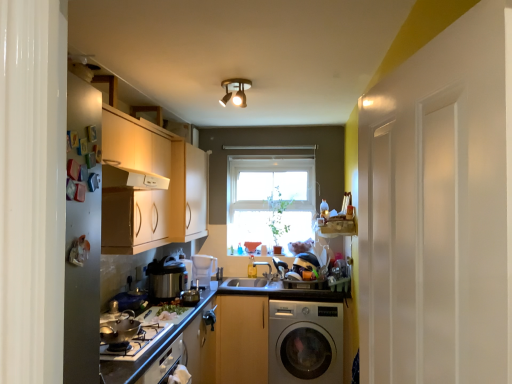
Question: From the image's perspective, is metallic pressure cooker at center over wooden cabinet at center, marked as the first cabinetry in a bottom-to-top arrangement?

Choices:
 (A) no
 (B) yes

Answer: (B)

Question: Considering the relative sizes of metallic pressure cooker at center and wooden cabinet at center, which is the 2th cabinetry from left to right, in the image provided, is metallic pressure cooker at center taller than wooden cabinet at center, which is the 2th cabinetry from left to right,?

Choices:
 (A) yes
 (B) no

Answer: (B)

Question: Is metallic pressure cooker at center thinner than wooden cabinet at center, which is the 2th cabinetry from left to right?

Choices:
 (A) no
 (B) yes

Answer: (B)

Question: From the image's perspective, is metallic pressure cooker at center below wooden cabinet at center, acting as the second cabinetry starting from the top?

Choices:
 (A) yes
 (B) no

Answer: (B)

Question: Is wooden cabinet at center, which is the 2th cabinetry from left to right, inside metallic pressure cooker at center?

Choices:
 (A) no
 (B) yes

Answer: (A)

Question: Is metallic pressure cooker at center facing away from wooden cabinet at center, arranged as the first cabinetry when viewed from the right?

Choices:
 (A) yes
 (B) no

Answer: (B)

Question: Can you confirm if matte white countertop at lower left is positioned to the right of wooden cabinet at center, marked as the first cabinetry in a bottom-to-top arrangement?

Choices:
 (A) yes
 (B) no

Answer: (B)

Question: Does matte white countertop at lower left have a larger size compared to wooden cabinet at center, acting as the second cabinetry starting from the top?

Choices:
 (A) no
 (B) yes

Answer: (B)

Question: Is matte white countertop at lower left to the left of wooden cabinet at center, acting as the second cabinetry starting from the top, from the viewer's perspective?

Choices:
 (A) yes
 (B) no

Answer: (A)

Question: Is matte white countertop at lower left aimed at wooden cabinet at center, which is the 2th cabinetry from left to right?

Choices:
 (A) yes
 (B) no

Answer: (A)

Question: Is matte white countertop at lower left smaller than wooden cabinet at center, acting as the second cabinetry starting from the top?

Choices:
 (A) yes
 (B) no

Answer: (B)

Question: Is matte white countertop at lower left further to the viewer compared to wooden cabinet at center, arranged as the first cabinetry when viewed from the right?

Choices:
 (A) no
 (B) yes

Answer: (A)

Question: Considering the relative positions of wooden cabinet at center, marked as the first cabinetry in a bottom-to-top arrangement, and white plastic pitcher at center, positioned as the 1th appliance in right-to-left order, in the image provided, is wooden cabinet at center, marked as the first cabinetry in a bottom-to-top arrangement, to the right of white plastic pitcher at center, positioned as the 1th appliance in right-to-left order, from the viewer's perspective?

Choices:
 (A) no
 (B) yes

Answer: (B)